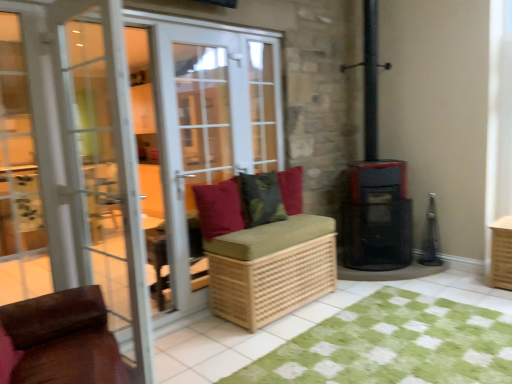
Question: From a real-world perspective, is matte white screen door at center, which is counted as the 2th screen door, starting from the front, positioned under velvet-like green cushion at center, which appears as the first pillow when viewed from the right, based on gravity?

Choices:
 (A) yes
 (B) no

Answer: (B)

Question: Is matte white screen door at center, which is the first screen door from back to front, located outside velvet-like green cushion at center, which appears as the first pillow when viewed from the right?

Choices:
 (A) no
 (B) yes

Answer: (B)

Question: Can you confirm if matte white screen door at center, which is counted as the 2th screen door, starting from the front, is shorter than velvet-like green cushion at center, which appears as the first pillow when viewed from the right?

Choices:
 (A) no
 (B) yes

Answer: (A)

Question: Considering the relative sizes of matte white screen door at center, which is the first screen door from back to front, and velvet-like green cushion at center, the third pillow viewed from the left, in the image provided, is matte white screen door at center, which is the first screen door from back to front, thinner than velvet-like green cushion at center, the third pillow viewed from the left,?

Choices:
 (A) no
 (B) yes

Answer: (A)

Question: From the image's perspective, is matte white screen door at center, which is counted as the 2th screen door, starting from the front, below velvet-like green cushion at center, the third pillow viewed from the left?

Choices:
 (A) yes
 (B) no

Answer: (B)

Question: Is matte white screen door at center, which is counted as the 2th screen door, starting from the front, further to camera compared to velvet-like green cushion at center, which appears as the first pillow when viewed from the right?

Choices:
 (A) yes
 (B) no

Answer: (B)

Question: Is velvet red pillow at center, the first pillow positioned from the left, not near matte white screen door at center, which is counted as the 2th screen door, starting from the front?

Choices:
 (A) no
 (B) yes

Answer: (A)

Question: From the image's perspective, is velvet red pillow at center, the first pillow positioned from the left, located beneath matte white screen door at center, which is the first screen door from back to front?

Choices:
 (A) yes
 (B) no

Answer: (A)

Question: Considering the relative positions of velvet red pillow at center, the 3th pillow in the right-to-left sequence, and matte white screen door at center, which is counted as the 2th screen door, starting from the front, in the image provided, is velvet red pillow at center, the 3th pillow in the right-to-left sequence, to the right of matte white screen door at center, which is counted as the 2th screen door, starting from the front, from the viewer's perspective?

Choices:
 (A) yes
 (B) no

Answer: (A)

Question: Is velvet red pillow at center, the 3th pillow in the right-to-left sequence, oriented towards matte white screen door at center, which is the first screen door from back to front?

Choices:
 (A) no
 (B) yes

Answer: (A)

Question: Is velvet red pillow at center, the 3th pillow in the right-to-left sequence, completely or partially outside of matte white screen door at center, which is counted as the 2th screen door, starting from the front?

Choices:
 (A) no
 (B) yes

Answer: (A)

Question: Does velvet red pillow at center, the first pillow positioned from the left, have a greater height compared to matte white screen door at center, which is counted as the 2th screen door, starting from the front?

Choices:
 (A) yes
 (B) no

Answer: (B)

Question: Is green checkered rug at lower center to the left of green textured cushion at center, placed as the 2th pillow when sorted from left to right, from the viewer's perspective?

Choices:
 (A) yes
 (B) no

Answer: (B)